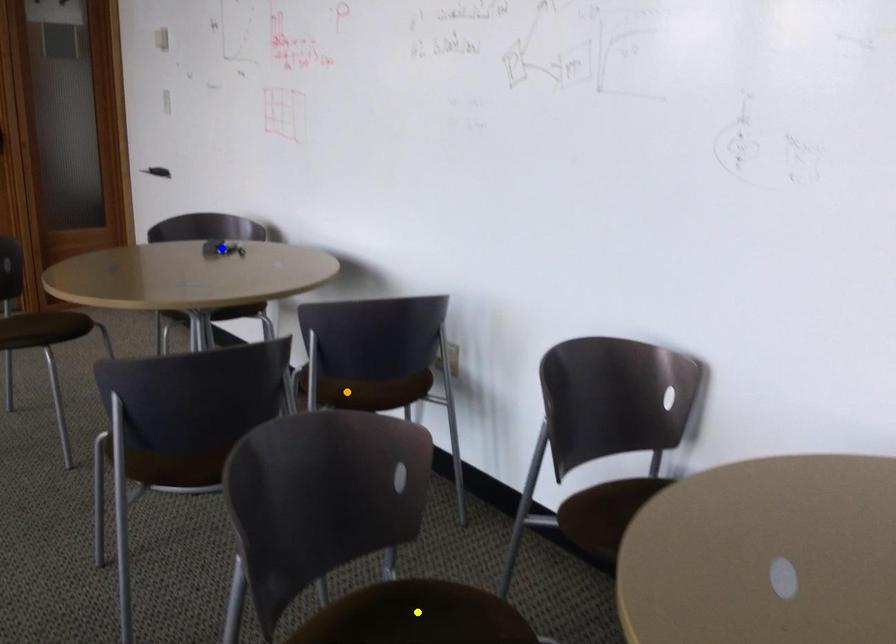
Order these from nearest to farthest:
yellow point | blue point | orange point

yellow point
orange point
blue point